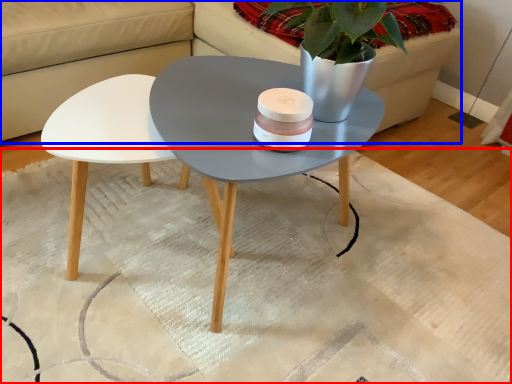
Question: Which point is further to the camera, mat (highlighted by a red box) or couch (highlighted by a blue box)?

Choices:
 (A) mat
 (B) couch

Answer: (B)